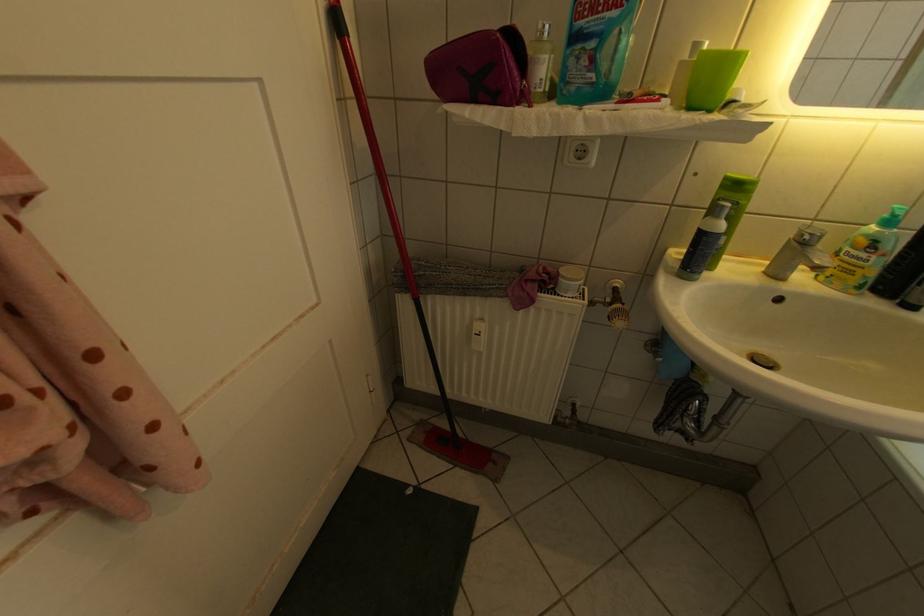
The image size is (924, 616). What do you see at coordinates (387, 199) in the screenshot? I see `a red mop handle` at bounding box center [387, 199].